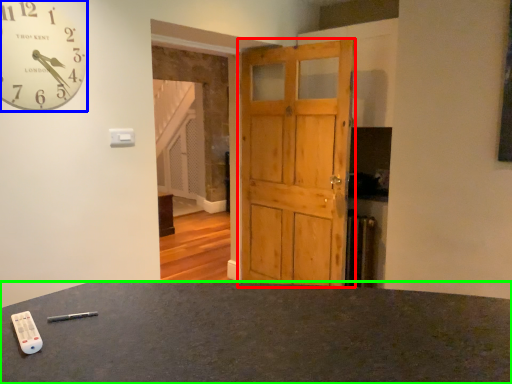
Question: Which object is positioned closest to barn door (highlighted by a red box)? Select from wall clock (highlighted by a blue box) and desk (highlighted by a green box).

Choices:
 (A) wall clock
 (B) desk

Answer: (A)